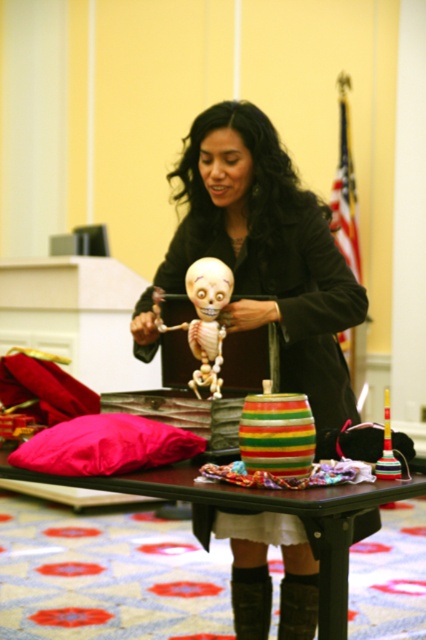
Is point (199, 320) positioned in front of point (305, 636)?

Yes, point (199, 320) is closer to viewer.

Who is higher up, smooth beige skeleton at center or leather at lower center?

Positioned higher is smooth beige skeleton at center.

This screenshot has width=426, height=640. What do you see at coordinates (203, 320) in the screenshot? I see `smooth beige skeleton at center` at bounding box center [203, 320].

Locate an element on the screen. The width and height of the screenshot is (426, 640). smooth beige skeleton at center is located at coordinates (203, 320).

Can you confirm if striped wooden table at center is positioned below black leather boot at lower center?

No.

Between striped wooden table at center and black leather boot at lower center, which one has more height?

With more height is striped wooden table at center.

You are a GUI agent. You are given a task and a screenshot of the screen. Output one action in this format:
    pyautogui.click(x=<x>, y=<y>)
    Task: Click on the striped wooden table at center
    The height and width of the screenshot is (640, 426).
    Given the screenshot: What is the action you would take?
    pyautogui.click(x=270, y=508)

Is point (319, 621) positioned after point (290, 602)?

No, it is not.

In the scene shown: Between striped wooden table at center and leather at lower center, which one has more height?

With more height is striped wooden table at center.

Does point (5, 467) come closer to viewer compared to point (294, 589)?

Yes, point (5, 467) is in front of point (294, 589).

You are a GUI agent. You are given a task and a screenshot of the screen. Output one action in this format:
    pyautogui.click(x=<x>, y=<y>)
    Task: Click on the striped wooden table at center
    Image resolution: width=426 pixels, height=640 pixels.
    Given the screenshot: What is the action you would take?
    pyautogui.click(x=270, y=508)